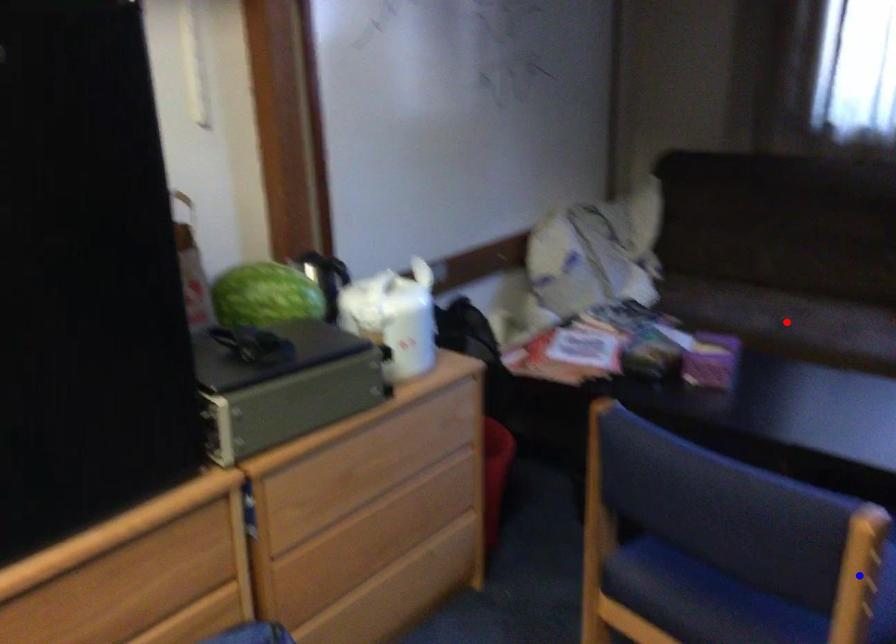
Question: In the image, two points are highlighted. Which point is nearer to the camera? Reply with the corresponding letter.

Choices:
 (A) blue point
 (B) red point

Answer: (A)